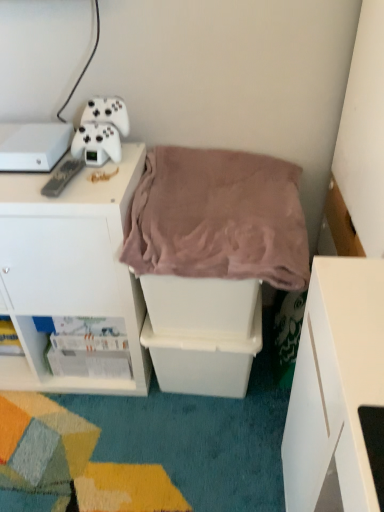
Where is `blank space situated above white glossy magazine at lower left, the first shelf positioned from the left (from a real-world perspective)`? The height and width of the screenshot is (512, 384). blank space situated above white glossy magazine at lower left, the first shelf positioned from the left (from a real-world perspective) is located at coordinates (85, 352).